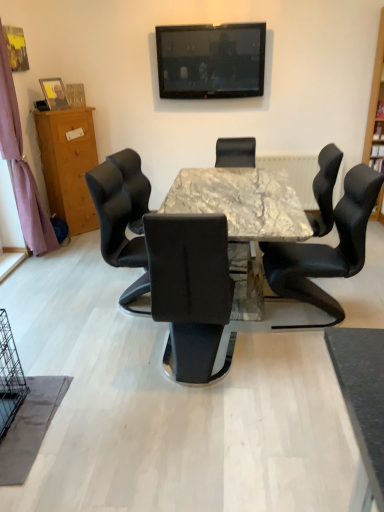
Question: Is matte wooden picture frame at left inside or outside of black glossy television at upper center?

Choices:
 (A) inside
 (B) outside

Answer: (B)

Question: Is matte wooden picture frame at left in front of or behind black glossy television at upper center in the image?

Choices:
 (A) behind
 (B) front

Answer: (A)

Question: Which is nearer to the black glossy television at upper center?

Choices:
 (A) purple fabric curtain at left
 (B) black leather chair at right, the first chair from the front
 (C) black leather chair at center, positioned as the second chair in front-to-back order
 (D) wooden bookshelf at right
 (E) wooden cabinet at left

Answer: (E)

Question: Which object is positioned farthest from the black leather chair at center, acting as the third chair starting from the front?

Choices:
 (A) wooden cabinet at left
 (B) black leather chair at center, which is the 2th chair in back-to-front order
 (C) black glossy television at upper center
 (D) purple fabric curtain at left
 (E) marble table at center

Answer: (D)